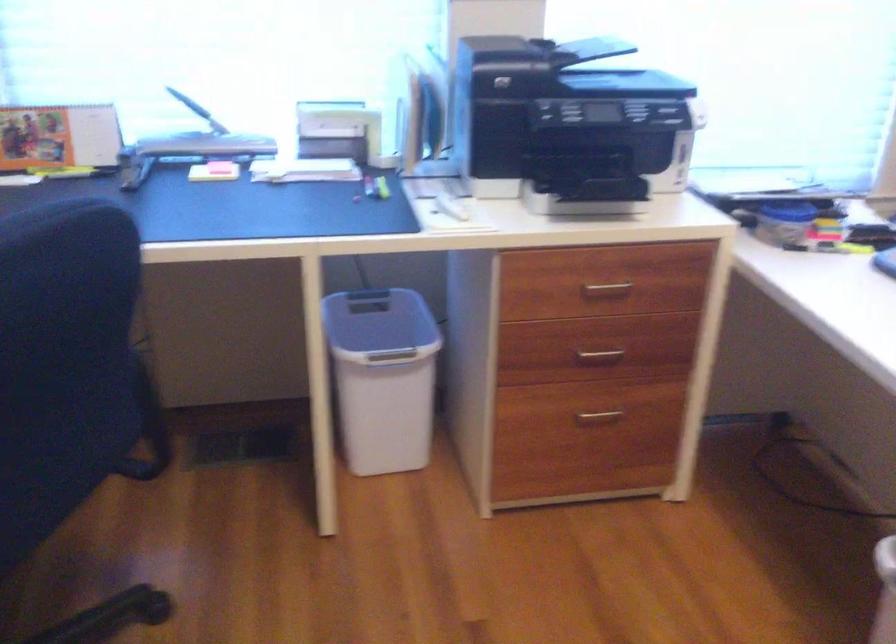
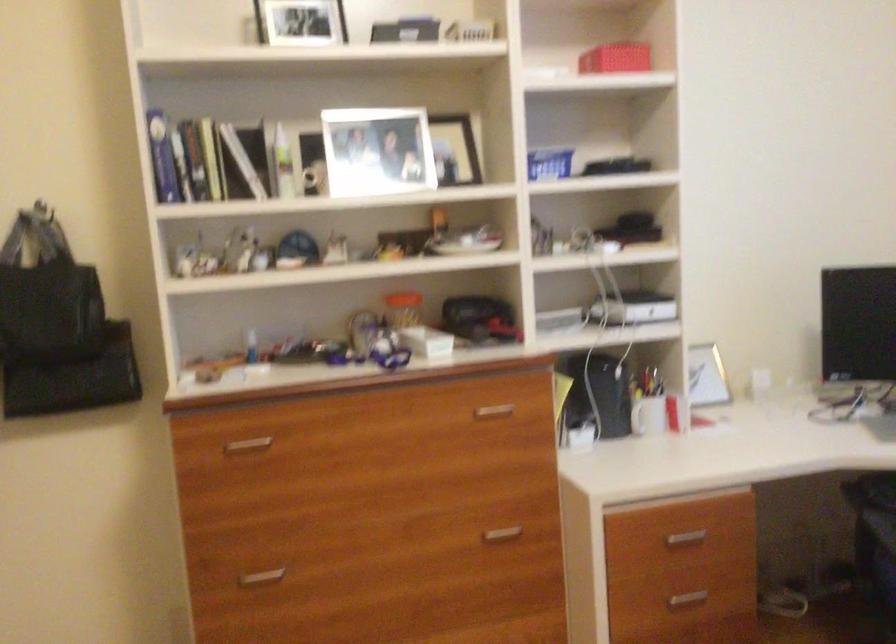
Question: Based on the continuous images, in which direction is the camera rotating? Reply with the corresponding letter.

Choices:
 (A) Left
 (B) Right
 (C) Up
 (D) Down

Answer: (A)